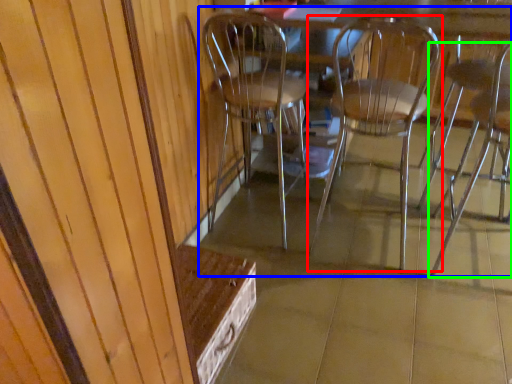
Question: Which is farther away from chair (highlighted by a red box)? chair (highlighted by a blue box) or chair (highlighted by a green box)?

Choices:
 (A) chair
 (B) chair

Answer: (B)